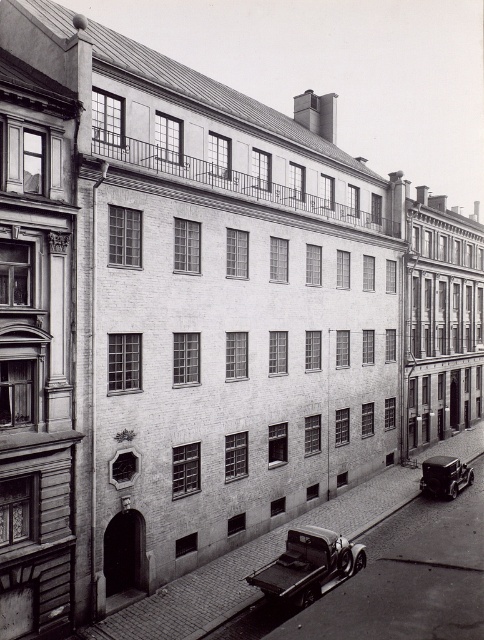
Based on the photo, you are standing in front of the multi story brick building and want to determine the relative positions of two points marked on the facade. Which point is closer to you, point (319, 566) or point (449, 472)?

Point (319, 566) is closer to the viewer than point (449, 472).

You are a pedestrian standing at the entrance of the central building and want to cross the street to reach the shiny black car at lower right. Is the metallic silver truck at center blocking your path?

The metallic silver truck at center is to the left of the shiny black car at lower right, so it is not directly blocking the path to the shiny black car at lower right. However, the pedestrian should still check for any potential obstacles or traffic before crossing.